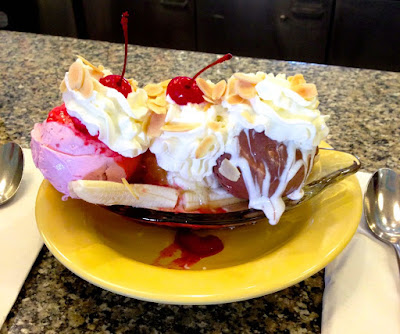
The image size is (400, 334). I want to click on glass bowl, so [x=337, y=179].